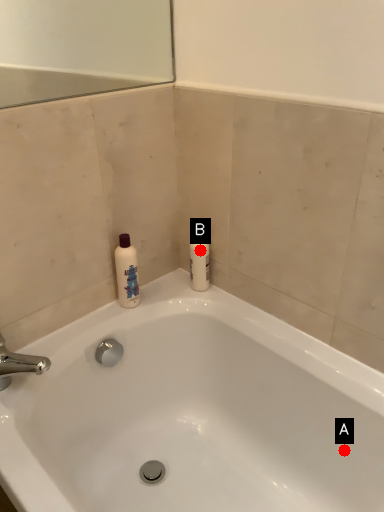
Question: Two points are circled on the image, labeled by A and B beside each circle. Which point is closer to the camera taking this photo?

Choices:
 (A) A is closer
 (B) B is closer

Answer: (A)